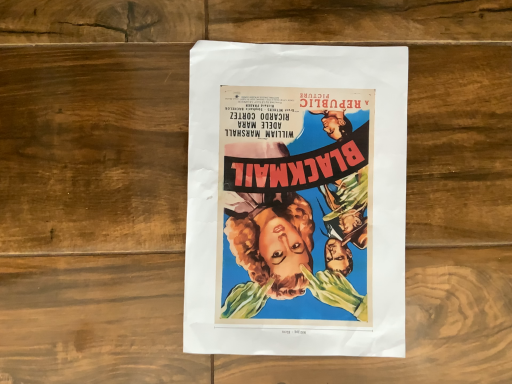
Image resolution: width=512 pixels, height=384 pixels. What do you see at coordinates (296, 200) in the screenshot? I see `vibrant paper poster at center` at bounding box center [296, 200].

Identify the location of vibrant paper poster at center. (296, 200).

In order to face vibrant paper poster at center, should I rotate leftwards or rightwards?

You should rotate right by 5.779 degrees.

Find the location of a particular element. vibrant paper poster at center is located at coordinates (296, 200).